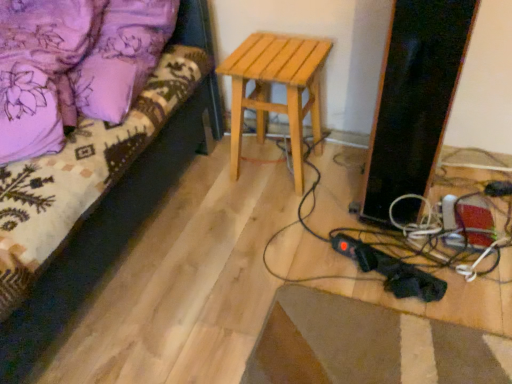
Question: Should I look upward or downward to see light brown wooden stool at center?

Choices:
 (A) down
 (B) up

Answer: (B)

Question: Considering the relative sizes of velvet purple bedspread at upper left and light brown wooden stool at center in the image provided, is velvet purple bedspread at upper left thinner than light brown wooden stool at center?

Choices:
 (A) no
 (B) yes

Answer: (A)

Question: Is velvet purple bedspread at upper left at the left side of light brown wooden stool at center?

Choices:
 (A) yes
 (B) no

Answer: (A)

Question: Would you say velvet purple bedspread at upper left is outside light brown wooden stool at center?

Choices:
 (A) no
 (B) yes

Answer: (B)

Question: From the image's perspective, does velvet purple bedspread at upper left appear lower than light brown wooden stool at center?

Choices:
 (A) yes
 (B) no

Answer: (A)

Question: From the image's perspective, is velvet purple bedspread at upper left located above light brown wooden stool at center?

Choices:
 (A) no
 (B) yes

Answer: (A)

Question: Is the position of velvet purple bedspread at upper left less distant than that of light brown wooden stool at center?

Choices:
 (A) no
 (B) yes

Answer: (B)

Question: From a real-world perspective, is light brown wooden stool at center on top of velvet purple bedspread at upper left?

Choices:
 (A) no
 (B) yes

Answer: (A)

Question: Is light brown wooden stool at center in front of velvet purple bedspread at upper left?

Choices:
 (A) no
 (B) yes

Answer: (A)

Question: From a real-world perspective, is light brown wooden stool at center located beneath velvet purple bedspread at upper left?

Choices:
 (A) no
 (B) yes

Answer: (B)

Question: Is light brown wooden stool at center bigger than velvet purple bedspread at upper left?

Choices:
 (A) yes
 (B) no

Answer: (B)

Question: Could velvet purple bedspread at upper left be considered to be inside light brown wooden stool at center?

Choices:
 (A) yes
 (B) no

Answer: (B)

Question: Considering the relative sizes of light brown wooden stool at center and velvet purple bedspread at upper left in the image provided, is light brown wooden stool at center thinner than velvet purple bedspread at upper left?

Choices:
 (A) no
 (B) yes

Answer: (B)

Question: From the image's perspective, relative to light brown wooden stool at center, is velvet purple bedspread at upper left above or below?

Choices:
 (A) below
 (B) above

Answer: (A)